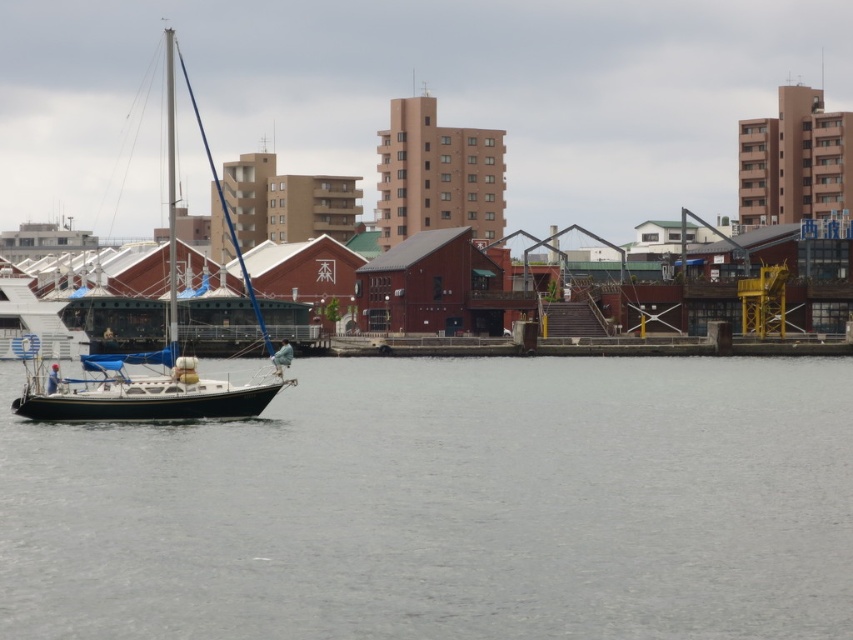
You are a photographer standing on the dock and want to capture both the clear water at lower left and the white matte sailboat at center in a single shot. Based on their positions, which object should you adjust your camera to focus on first to ensure both are in the frame?

The clear water at lower left is to the right of the white matte sailboat at center, so you should focus on the white matte sailboat at center first and then pan slightly to the right to include the clear water at lower left in the frame.

You are standing at the point marked as point (447,506). Looking around, you see the clear water at lower left. Which direction should you walk to reach the clear water at lower left?

You are already at the clear water at lower left, as the point (447,506) is where it is located.